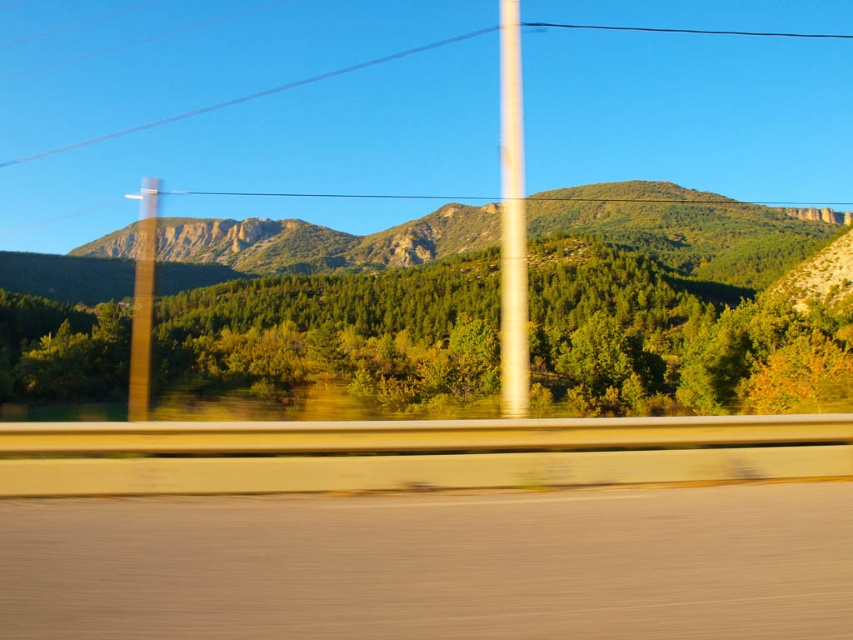
You are a driver planning to take a photo of the green textured mountain at center while driving on the smooth asphalt highway at lower center. Which object will occupy more of the camera frame when captured?

The green textured mountain at center will occupy more of the camera frame than the smooth asphalt highway at lower center because the green textured mountain at center occupies more space according to the description.